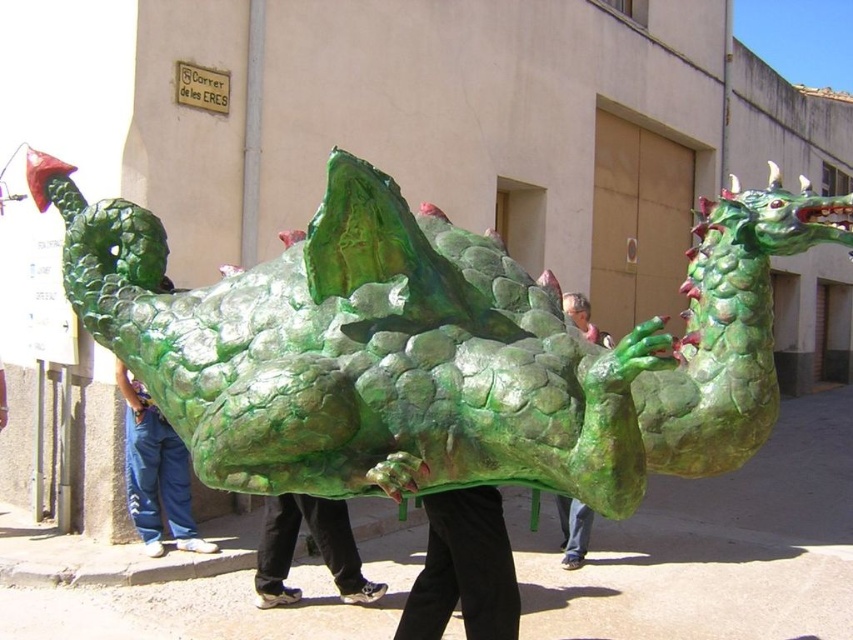
Does green scaly dragon at center appear under green matte dragon at center?

No, green scaly dragon at center is not below green matte dragon at center.

Which is behind, point (149, 241) or point (604, 333)?

The point (604, 333) is more distant.

Describe the element at coordinates (433, 348) in the screenshot. I see `green scaly dragon at center` at that location.

Locate an element on the screen. Image resolution: width=853 pixels, height=640 pixels. green scaly dragon at center is located at coordinates (433, 348).

Does green scaly dragon at center have a lesser width compared to blue jeans at lower left?

No.

In the scene shown: Between green scaly dragon at center and blue jeans at lower left, which one appears on the left side from the viewer's perspective?

Positioned to the left is blue jeans at lower left.

Image resolution: width=853 pixels, height=640 pixels. In order to click on green scaly dragon at center in this screenshot , I will do `click(433, 348)`.

Can you confirm if green matte pants at center is wider than green matte dragon at center?

Indeed, green matte pants at center has a greater width compared to green matte dragon at center.

Does green matte pants at center appear under green matte dragon at center?

No, green matte pants at center is not below green matte dragon at center.

Is point (273, 605) in front of point (585, 540)?

Yes, point (273, 605) is closer to viewer.

Identify the location of green matte pants at center. click(x=316, y=547).